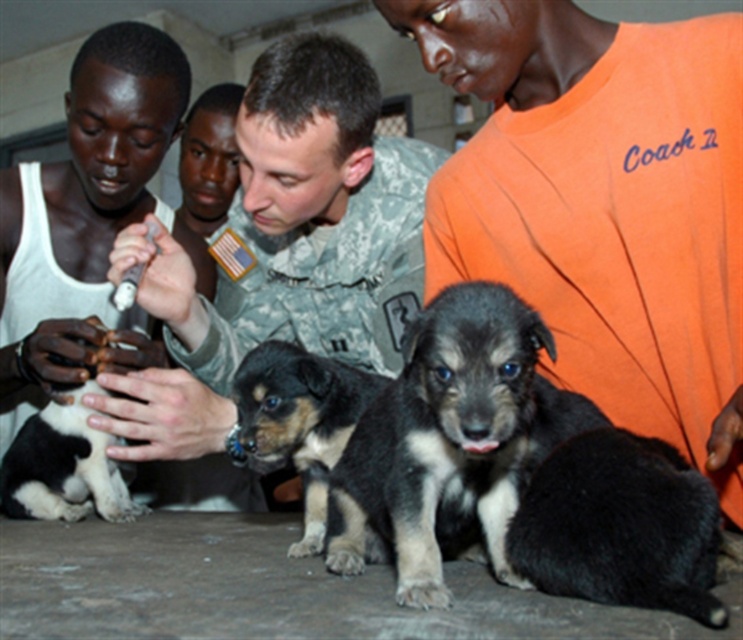
Is black fur puppy at center thinner than black and tan fur puppy at center?

No, black fur puppy at center is not thinner than black and tan fur puppy at center.

Who is higher up, black fur puppy at center or black and tan fur puppy at center?

black and tan fur puppy at center

Between point (415, 576) and point (304, 515), which one is positioned behind?

The point (304, 515) is behind.

At what (x,y) coordinates should I click in order to perform the action: click on black fur puppy at center. Please return your answer as a coordinate pair (x, y). Looking at the image, I should click on (447, 444).

This screenshot has height=640, width=743. I want to click on orange cotton shirt at upper right, so click(x=603, y=204).

Does orange cotton shirt at upper right appear on the right side of black and tan fur puppy at center?

Correct, you'll find orange cotton shirt at upper right to the right of black and tan fur puppy at center.

Describe the element at coordinates (603, 204) in the screenshot. I see `orange cotton shirt at upper right` at that location.

Image resolution: width=743 pixels, height=640 pixels. I want to click on orange cotton shirt at upper right, so click(603, 204).

At what (x,y) coordinates should I click in order to perform the action: click on orange cotton shirt at upper right. Please return your answer as a coordinate pair (x, y). This screenshot has height=640, width=743. Looking at the image, I should click on (603, 204).